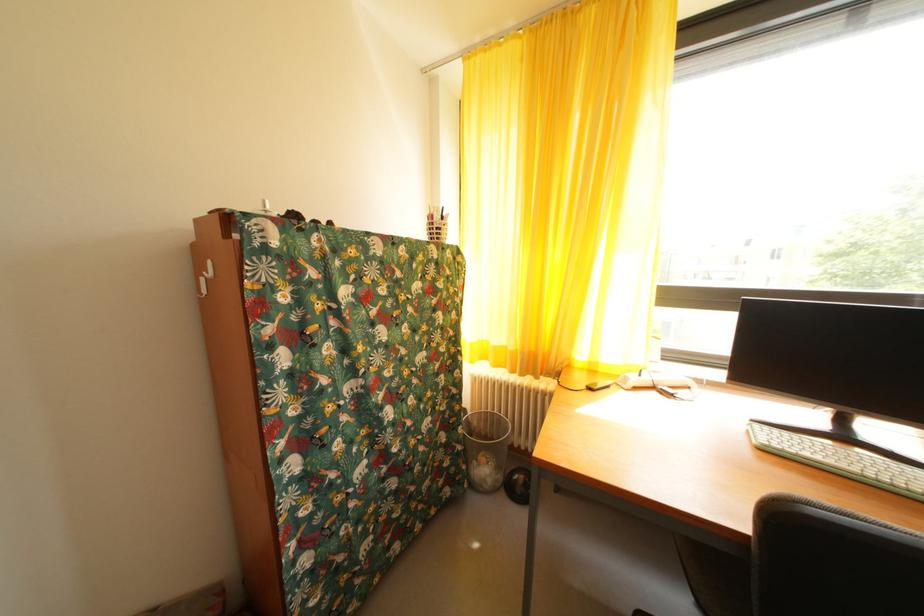
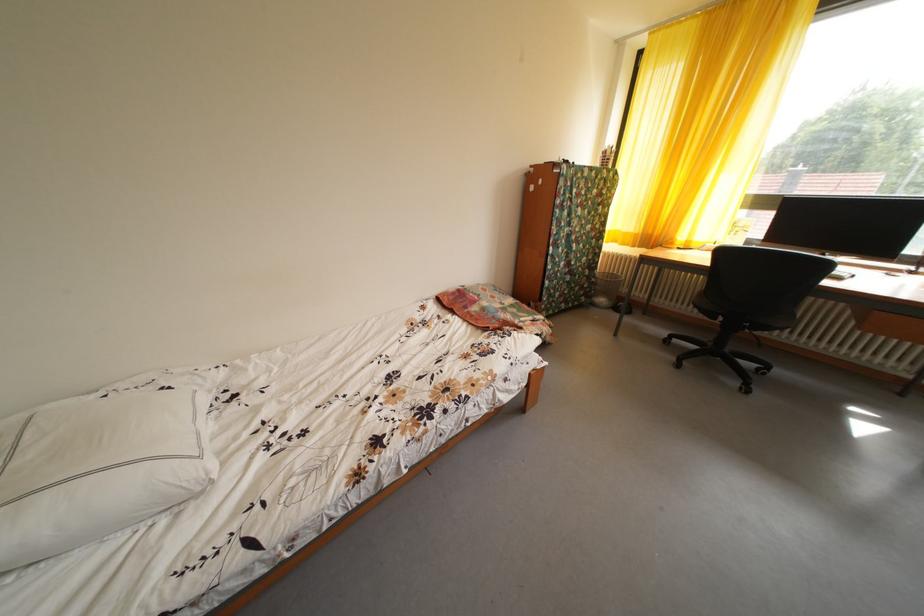
Question: I am providing you with two images of the same scene from different viewpoints. Please identify which objects are invisible in image2.

Choices:
 (A) patterned throw pillow
 (B) white power strip
 (C) yellow cleaning bottle
 (D) wire trash can

Answer: (B)